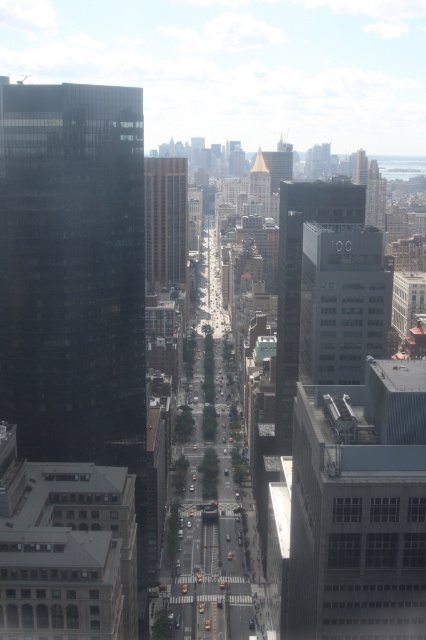
Question: Among these objects, which one is farthest from the camera?

Choices:
 (A) matte glass skyscraper at center
 (B) glossy glass building at left
 (C) gray concrete building at right
 (D) dark glass skyscraper at center

Answer: (D)

Question: Which object is positioned closest to the matte glass skyscraper at center?

Choices:
 (A) gold metallic tower at center
 (B) dark glass skyscraper at center
 (C) glossy glass building at left
 (D) gold glass skyscraper at center

Answer: (B)

Question: Can you confirm if dark glass skyscraper at center is positioned below gold glass skyscraper at center?

Choices:
 (A) no
 (B) yes

Answer: (B)

Question: Based on their relative distances, which object is farther from the matte glass skyscraper at center?

Choices:
 (A) dark glass skyscraper at center
 (B) gold metallic tower at center
 (C) gray concrete building at right

Answer: (B)

Question: Considering the relative positions of glossy glass building at left and gold glass skyscraper at center in the image provided, where is glossy glass building at left located with respect to gold glass skyscraper at center?

Choices:
 (A) below
 (B) above

Answer: (A)

Question: Is dark glass skyscraper at center further to the viewer compared to gold glass skyscraper at center?

Choices:
 (A) no
 (B) yes

Answer: (A)